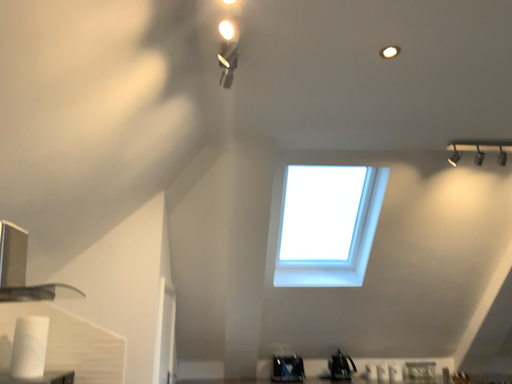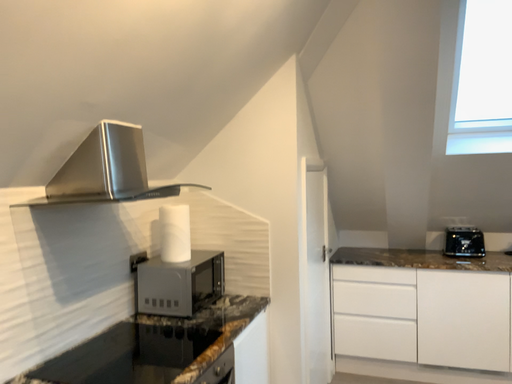
Question: Which way did the camera rotate in the video?

Choices:
 (A) rotated downward
 (B) rotated upward

Answer: (A)